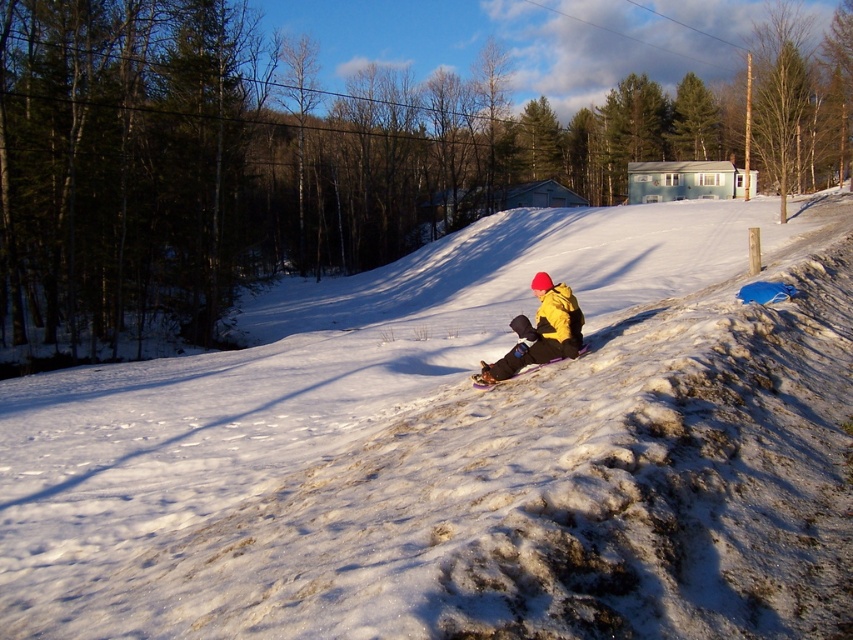
You are a photographer trying to capture the yellow matte jacket at center and the white fluffy snow at center in a single shot. Based on their positions, which object should you adjust your camera to focus on first to ensure both are in frame?

The white fluffy snow at center is positioned on the left side of yellow matte jacket at center, so you should focus on the yellow matte jacket at center first to ensure both objects are captured in the frame.

You are standing at the bottom of the snowy hill and want to place a small red flag exactly at the center of the white fluffy snow at center. According to the coordinates provided, where should you place the flag?

You should place the flag at the coordinates point (462, 449) where the white fluffy snow at center is located.